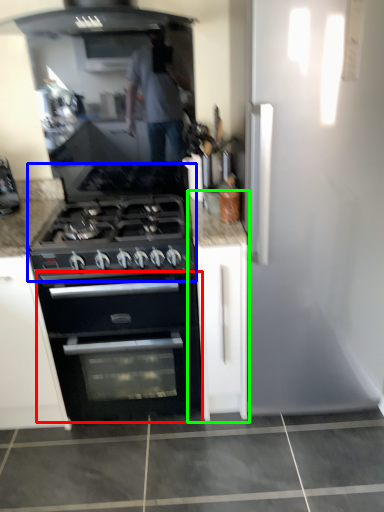
Question: Estimate the real-world distances between objects in this image. Which object is closer to oven (highlighted by a red box), gas stove (highlighted by a blue box) or cabinetry (highlighted by a green box)?

Choices:
 (A) gas stove
 (B) cabinetry

Answer: (B)